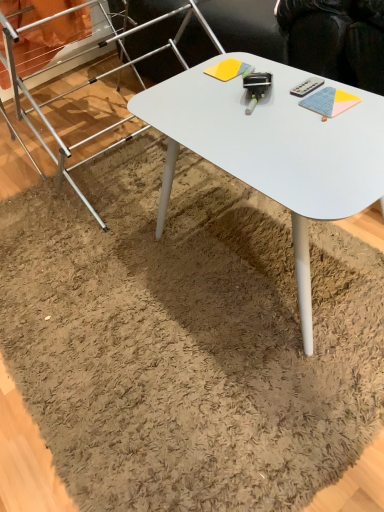
Question: Is yellow matte notepad at center, the first notepad when ordered from back to front, a part of white matte desk at center?

Choices:
 (A) yes
 (B) no

Answer: (A)

Question: From the image's perspective, is white matte desk at center beneath yellow matte notepad at center, which is counted as the 1th notepad, starting from the left?

Choices:
 (A) no
 (B) yes

Answer: (B)

Question: Can you confirm if white matte desk at center is taller than yellow matte notepad at center, arranged as the 2th notepad when ordered from the bottom?

Choices:
 (A) yes
 (B) no

Answer: (A)

Question: Can you confirm if white matte desk at center is wider than yellow matte notepad at center, the second notepad in the right-to-left sequence?

Choices:
 (A) yes
 (B) no

Answer: (A)

Question: Can you confirm if white matte desk at center is bigger than yellow matte notepad at center, marked as the first notepad in a top-to-bottom arrangement?

Choices:
 (A) no
 (B) yes

Answer: (B)

Question: Is white matte desk at center positioned with its back to yellow matte notepad at center, which ranks as the second notepad in front-to-back order?

Choices:
 (A) yes
 (B) no

Answer: (B)

Question: Does yellow matte notepad at center, marked as the first notepad in a top-to-bottom arrangement, have a smaller size compared to white matte desk at center?

Choices:
 (A) yes
 (B) no

Answer: (A)

Question: Can you confirm if yellow matte notepad at center, arranged as the 2th notepad when ordered from the bottom, is wider than white matte desk at center?

Choices:
 (A) yes
 (B) no

Answer: (B)

Question: Is yellow matte notepad at center, which ranks as the second notepad in front-to-back order, at the left side of white matte desk at center?

Choices:
 (A) yes
 (B) no

Answer: (A)

Question: Is yellow matte notepad at center, which is counted as the 1th notepad, starting from the left, oriented away from white matte desk at center?

Choices:
 (A) yes
 (B) no

Answer: (A)

Question: Does yellow matte notepad at center, which is counted as the 1th notepad, starting from the left, have a larger size compared to white matte desk at center?

Choices:
 (A) yes
 (B) no

Answer: (B)

Question: From a real-world perspective, is yellow matte notepad at center, which ranks as the second notepad in front-to-back order, beneath white matte desk at center?

Choices:
 (A) yes
 (B) no

Answer: (B)

Question: Can you confirm if silver metallic ladder at upper left is shorter than white matte desk at center?

Choices:
 (A) no
 (B) yes

Answer: (A)